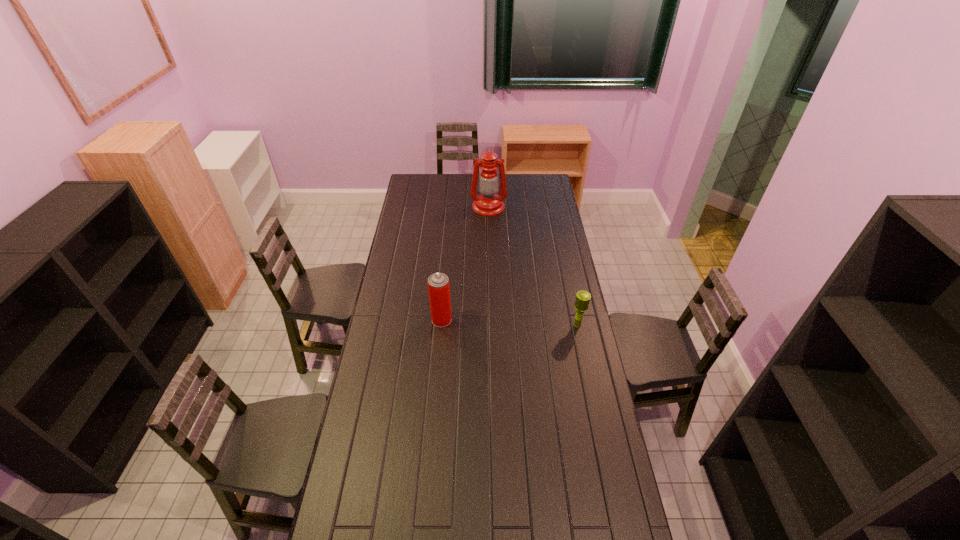
Choose which object is the nearest neighbor to the rightmost object. Please provide its 2D coordinates. Your answer should be formatted as a tuple, i.e. [(x, y)], where the tuple contains the x and y coordinates of a point satisfying the conditions above.

[(438, 283)]

Locate an element on the screen. vacant space that satisfies the following two spatial constraints: 1. on the front side of the oil lamp; 2. on the right side of the rightmost object is located at coordinates (492, 326).

At what (x,y) coordinates should I click in order to perform the action: click on free region that satisfies the following two spatial constraints: 1. on the front side of the shortest object; 2. on the right side of the aerosol can. Please return your answer as a coordinate pair (x, y). This screenshot has width=960, height=540. Looking at the image, I should click on (442, 326).

The image size is (960, 540). What are the coordinates of `vacant space that satisfies the following two spatial constraints: 1. on the back side of the oil lamp; 2. on the right side of the leftmost object` in the screenshot? It's located at (451, 207).